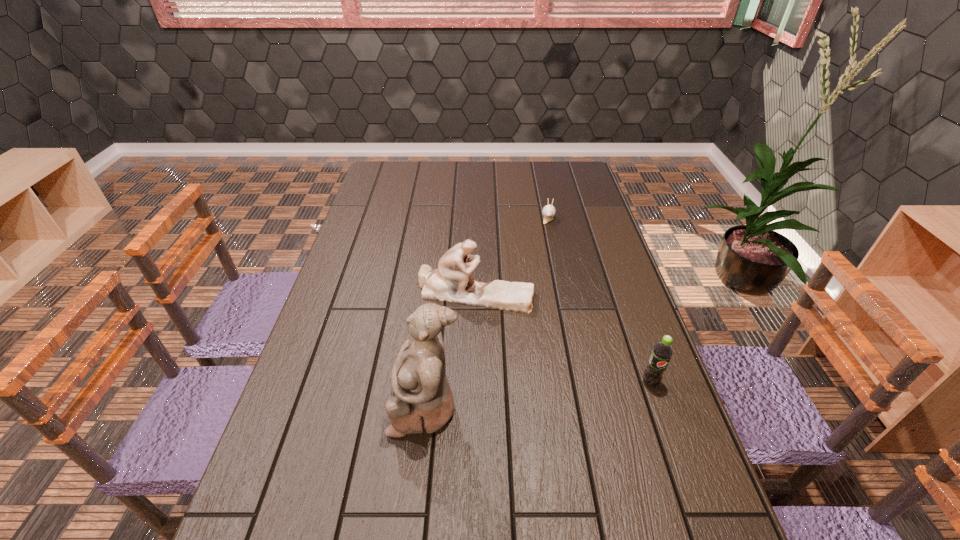
What are the coordinates of `vacant area that lies between the tallest object and the farthest object` in the screenshot? It's located at (487, 311).

This screenshot has height=540, width=960. I want to click on free area in between the soda and the shorter figurine, so click(563, 338).

At what (x,y) coordinates should I click in order to perform the action: click on free space between the taller figurine and the farther figurine. Please return your answer as a coordinate pair (x, y). The height and width of the screenshot is (540, 960). Looking at the image, I should click on (450, 350).

Find the location of a particular element. vacant space in between the shortest object and the soda is located at coordinates (599, 299).

Point out which object is positioned as the nearest to the second farthest object. Please provide its 2D coordinates. Your answer should be formatted as a tuple, i.e. [(x, y)], where the tuple contains the x and y coordinates of a point satisfying the conditions above.

[(423, 402)]

You are a GUI agent. You are given a task and a screenshot of the screen. Output one action in this format:
    pyautogui.click(x=<x>, y=<y>)
    Task: Click on the object that stands as the closest to the shortest object
    The width and height of the screenshot is (960, 540).
    Given the screenshot: What is the action you would take?
    pyautogui.click(x=452, y=282)